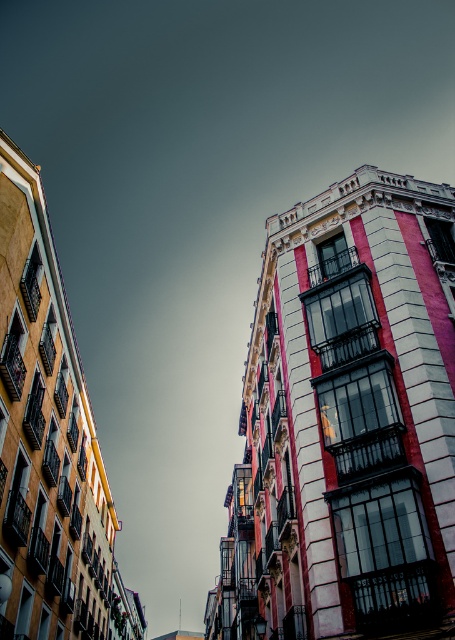
You are an architect planning to install a large billboard between the smooth pink building at center and the yellow painted building at left. Given that the billboard requires a minimum of 5 meters of space between the two buildings to be safely mounted, can you determine if there is enough space based on their widths?

The smooth pink building at center is wider than the yellow painted building at left. However, the question is about the distance between them, not their widths. The provided information only states their relative widths, not the actual distance separating them. Therefore, it is impossible to determine if there is enough space for the billboard based on the given data.

You are an architect analyzing the two buildings in the image. Which building, the smooth pink building at center or the yellow painted building at left, has a greater overall size?

The smooth pink building at center has a larger size compared to the yellow painted building at left.

You are standing at the entrance of the city park and see the smooth pink building at center. If you want to take a photo of it from the north side, which direction should you walk relative to the building?

The smooth pink building at center is located at point coordinates, so you should walk north to capture it from the north side.